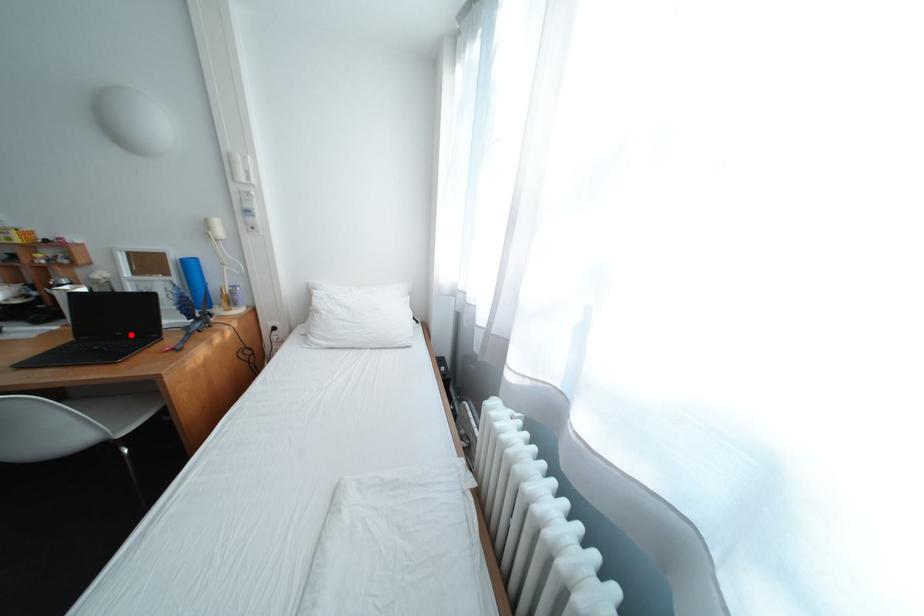
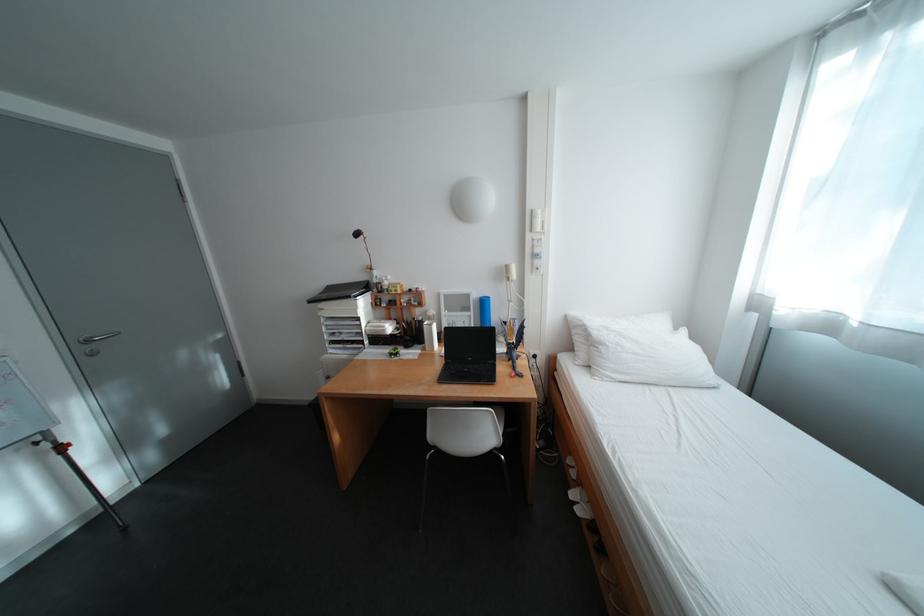
Find the pixel in the second image that matches the highlighted location in the first image.

(481, 360)